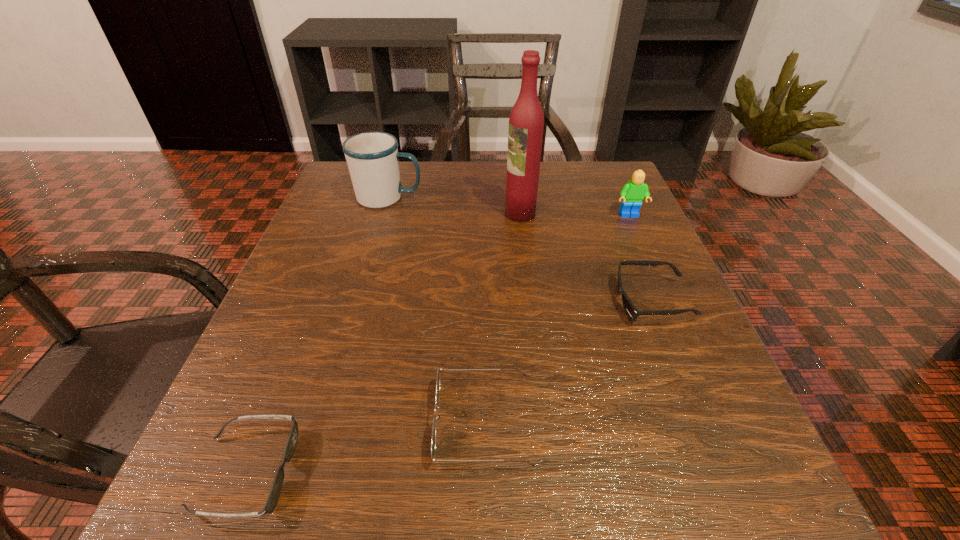
Where is `free spot at the far edge of the desktop`? The height and width of the screenshot is (540, 960). free spot at the far edge of the desktop is located at coordinates (474, 185).

At what (x,y) coordinates should I click in order to perform the action: click on free region at the near edge of the desktop. Please return your answer as a coordinate pair (x, y). Looking at the image, I should click on (401, 456).

In the image, there is a desktop. At what (x,y) coordinates should I click in order to perform the action: click on free region at the left edge. Please return your answer as a coordinate pair (x, y). Looking at the image, I should click on (354, 264).

This screenshot has width=960, height=540. In the image, there is a desktop. What are the coordinates of `vacant space at the right edge` in the screenshot? It's located at (703, 354).

This screenshot has width=960, height=540. I want to click on free space at the far right corner of the desktop, so click(558, 161).

Identify the location of empty location between the shortest object and the second tallest object. (317, 335).

I want to click on vacant region between the shortest sunglasses and the second sunglasses from left to right, so click(365, 447).

Image resolution: width=960 pixels, height=540 pixels. I want to click on vacant area between the fifth shortest object and the rightmost sunglasses, so click(x=520, y=249).

Locate an element on the screen. The width and height of the screenshot is (960, 540). vacant point located between the farthest sunglasses and the tallest object is located at coordinates (586, 258).

Identify the location of vacant area that lies between the fifth shortest object and the leftmost sunglasses. The image size is (960, 540). (317, 335).